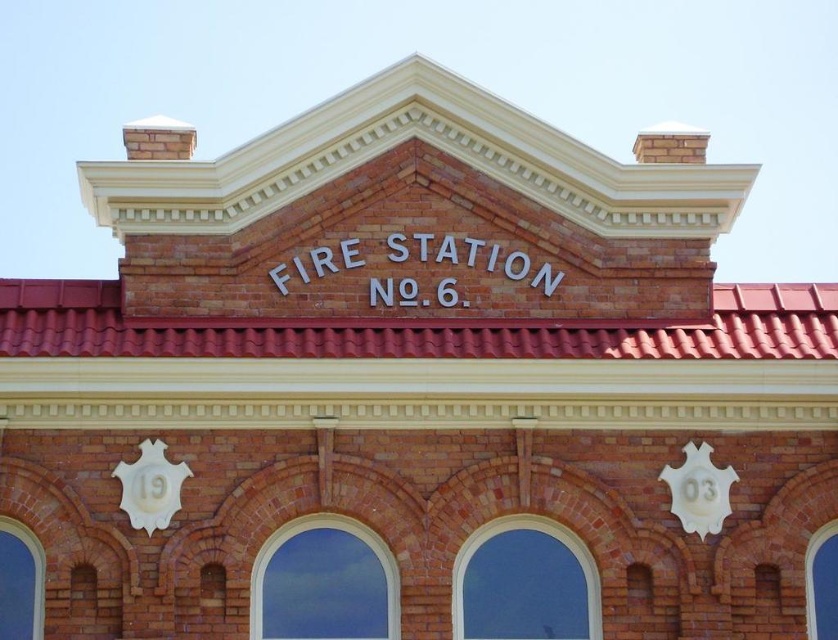
Is white glossy shield at center to the left of white glossy clock at lower left from the viewer's perspective?

In fact, white glossy shield at center is to the right of white glossy clock at lower left.

Which is behind, point (697, 520) or point (133, 513)?

Point (697, 520)

Who is more distant from viewer, (710, 483) or (158, 525)?

The point (710, 483) is behind.

Where is `white glossy shield at center`? The image size is (838, 640). white glossy shield at center is located at coordinates (697, 490).